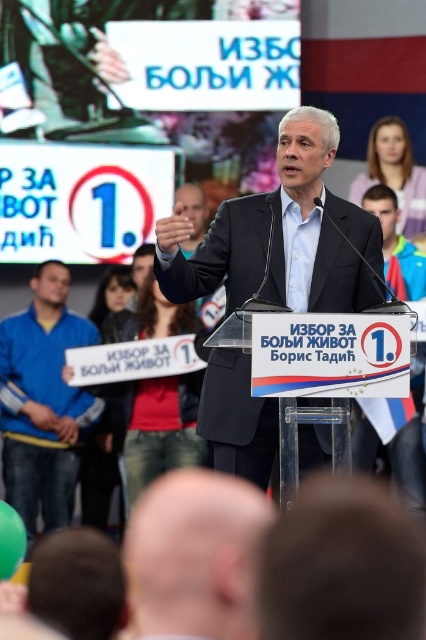
Question: Which of the following is the closest to the observer?

Choices:
 (A) smooth bald head at lower center
 (B) blue fabric jacket at upper right
 (C) pink fabric at upper right
 (D) matte black suit at center

Answer: (A)

Question: Considering the relative positions of blue fabric sign at left and blue fabric jacket at upper right in the image provided, where is blue fabric sign at left located with respect to blue fabric jacket at upper right?

Choices:
 (A) below
 (B) above

Answer: (A)

Question: Does matte black suit at center appear over blue fabric sign at left?

Choices:
 (A) no
 (B) yes

Answer: (B)

Question: Among these points, which one is nearest to the camera?

Choices:
 (A) (40, 390)
 (B) (244, 564)
 (C) (189, 396)
 (D) (409, 275)

Answer: (B)

Question: Does smooth bald head at lower center have a greater width compared to pink fabric at upper right?

Choices:
 (A) no
 (B) yes

Answer: (B)

Question: Which point appears closest to the camera in this image?

Choices:
 (A) (147, 586)
 (B) (65, 317)
 (C) (370, 193)
 (D) (296, 280)

Answer: (A)